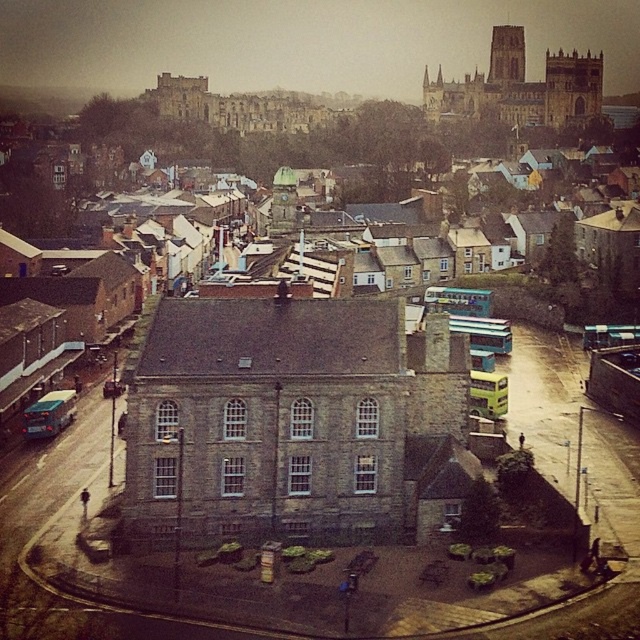
Between stone cathedral at upper right and dark stone tower at upper center, which one appears on the right side from the viewer's perspective?

dark stone tower at upper center is more to the right.

Between stone cathedral at upper right and dark stone tower at upper center, which one has less height?

With less height is dark stone tower at upper center.

Locate an element on the screen. This screenshot has height=640, width=640. stone cathedral at upper right is located at coordinates (520, 88).

Identify the location of stone cathedral at upper right. The width and height of the screenshot is (640, 640). (520, 88).

Is dark stone tower at upper right in front of dark stone tower at upper center?

Yes, dark stone tower at upper right is in front of dark stone tower at upper center.

How distant is dark stone tower at upper right from dark stone tower at upper center?

dark stone tower at upper right and dark stone tower at upper center are 24.57 meters apart.

Is point (573, 72) more distant than point (512, 26)?

No, (573, 72) is closer to viewer.

At what (x,y) coordinates should I click in order to perform the action: click on dark stone tower at upper right. Please return your answer as a coordinate pair (x, y). Image resolution: width=640 pixels, height=640 pixels. Looking at the image, I should click on (572, 88).

Can you confirm if stone cathedral at upper right is bigger than dark stone tower at upper right?

Correct, stone cathedral at upper right is larger in size than dark stone tower at upper right.

Who is taller, stone cathedral at upper right or dark stone tower at upper right?

stone cathedral at upper right is taller.

Who is more forward, (566,83) or (564,52)?

Point (566,83)

I want to click on stone cathedral at upper right, so click(x=520, y=88).